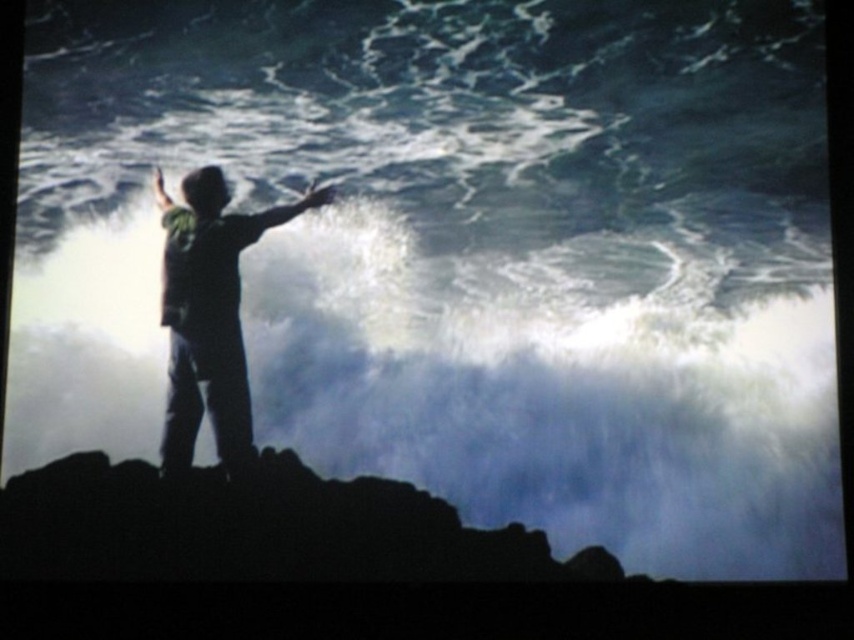
Question: Based on their relative distances, which object is farther from the silvery metallic arm at center?

Choices:
 (A) matte green shirt at center
 (B) silhouette clothing at center

Answer: (A)

Question: Which object is farther from the camera taking this photo?

Choices:
 (A) matte green shirt at center
 (B) silhouette clothing at center

Answer: (A)

Question: Does silhouette clothing at center appear on the right side of matte green shirt at center?

Choices:
 (A) no
 (B) yes

Answer: (B)

Question: Is silvery metallic arm at center further to the viewer compared to matte green shirt at center?

Choices:
 (A) yes
 (B) no

Answer: (A)

Question: Is silhouette clothing at center further to the viewer compared to silvery metallic arm at center?

Choices:
 (A) no
 (B) yes

Answer: (A)

Question: Which of these objects is positioned farthest from the silhouette clothing at center?

Choices:
 (A) silvery metallic arm at center
 (B) matte green shirt at center

Answer: (B)